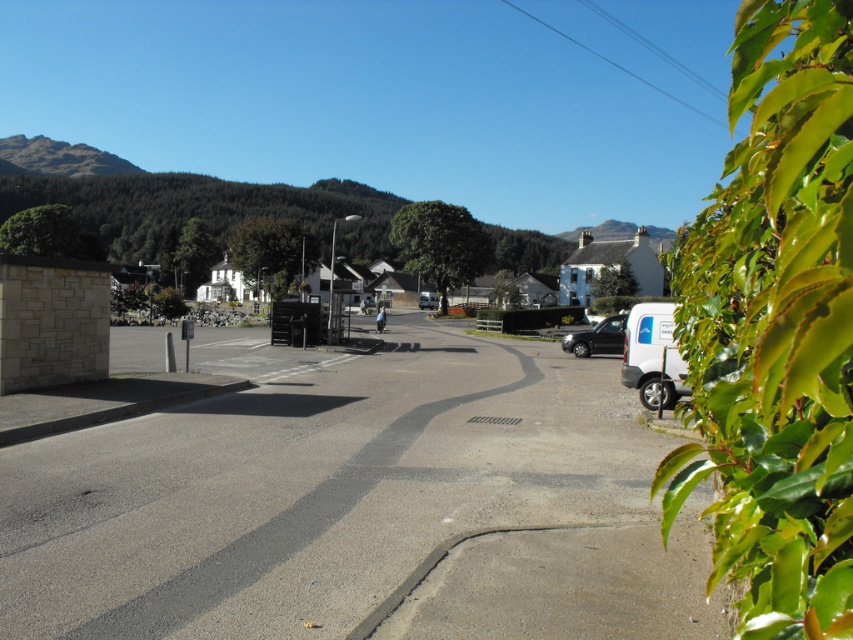
Question: Does shiny black car at center appear on the left side of white matte van at center?

Choices:
 (A) no
 (B) yes

Answer: (A)

Question: Which of the following is the closest to the observer?

Choices:
 (A) green leafy hedge at right
 (B) white matte van at center

Answer: (A)

Question: Which object is farther from the camera taking this photo?

Choices:
 (A) green leafy hedge at right
 (B) shiny black car at center
 (C) white matte van at center

Answer: (C)

Question: Does shiny black car at center lie behind white matte van at center?

Choices:
 (A) no
 (B) yes

Answer: (A)

Question: Which of the following is the farthest from the observer?

Choices:
 (A) white matte van at center
 (B) green leafy hedge at right

Answer: (A)

Question: Is green leafy hedge at right in front of white matte van at center?

Choices:
 (A) no
 (B) yes

Answer: (B)